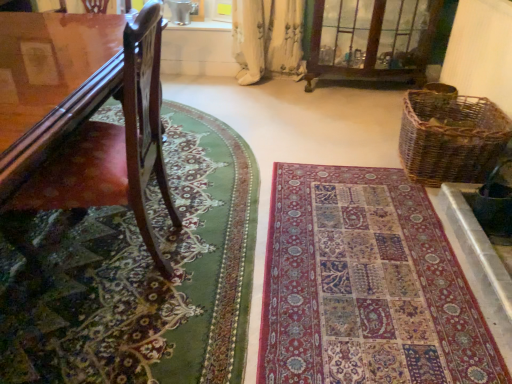
Where is `free spot to the left of woven brown picnic basket at right`? free spot to the left of woven brown picnic basket at right is located at coordinates (349, 150).